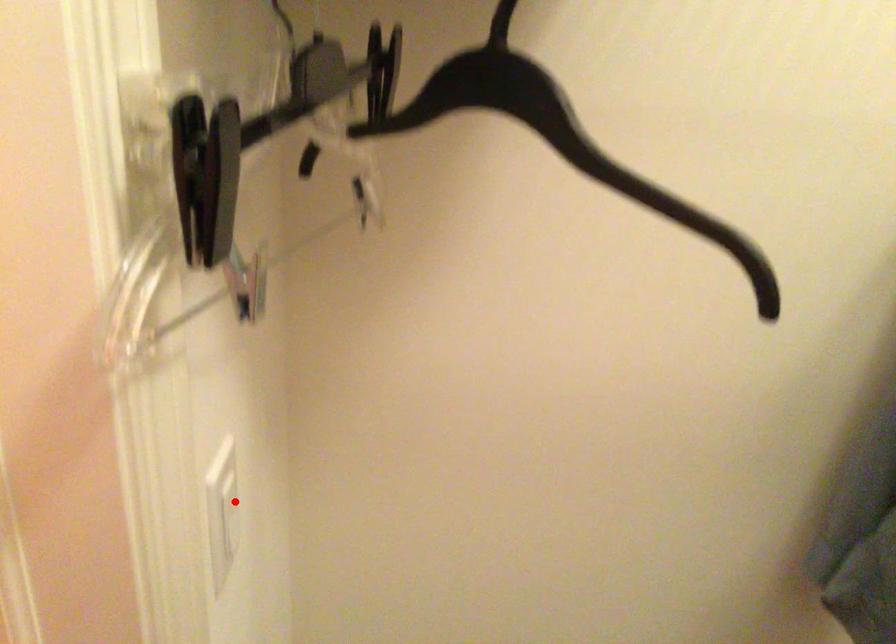
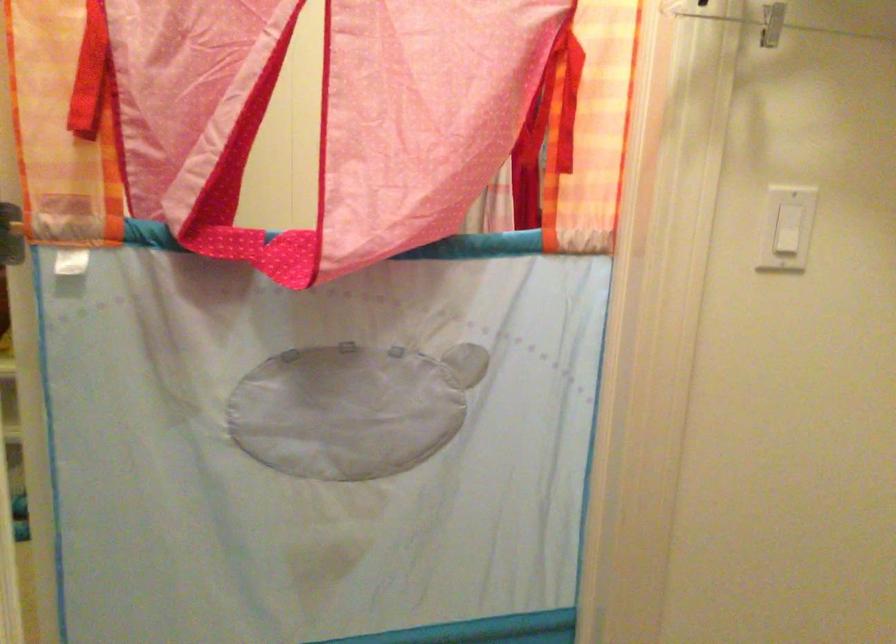
Question: I am providing you with two images of the same scene from different viewpoints. Given a red point in image1, look at the same physical point in image2. Is it:

Choices:
 (A) Closer to the viewpoint
 (B) Farther from the viewpoint

Answer: (B)